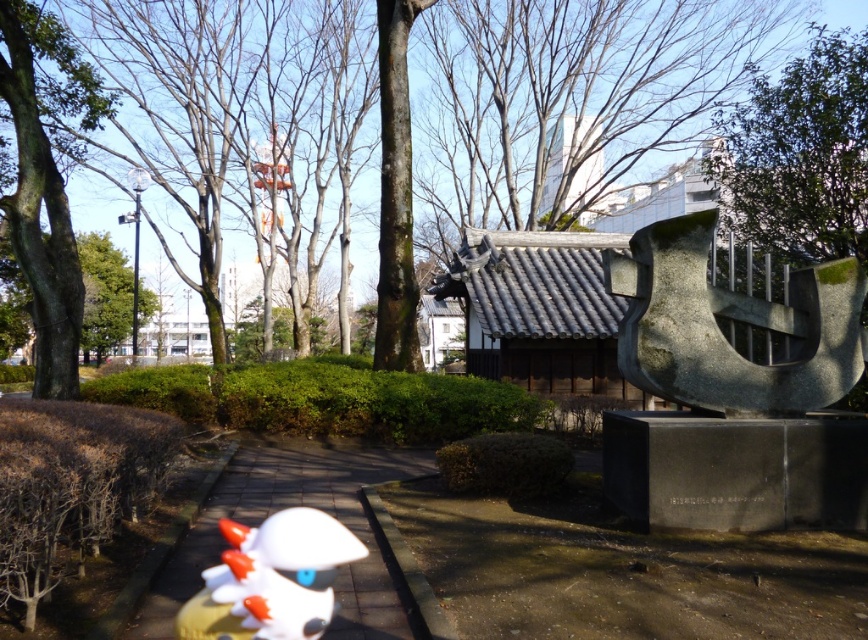
Question: Among these points, which one is farthest from the camera?

Choices:
 (A) (21, 291)
 (B) (731, 51)
 (C) (56, 346)
 (D) (299, 604)

Answer: (B)

Question: Can you confirm if brown wood tree at upper center is positioned below white matte duck at center?

Choices:
 (A) yes
 (B) no

Answer: (B)

Question: Estimate the real-world distances between objects in this image. Which object is farther from the white matte duck at center?

Choices:
 (A) brown wood tree at upper center
 (B) green leafy tree at left

Answer: (A)

Question: From the image, what is the correct spatial relationship of green leafy tree at left in relation to brown rough tree at left?

Choices:
 (A) below
 (B) above

Answer: (B)

Question: Which object is positioned closest to the brown rough tree at left?

Choices:
 (A) white matte duck at center
 (B) green stone sculpture at right
 (C) green leafy tree at left

Answer: (C)

Question: Can you confirm if green leafy tree at left is bigger than brown rough tree at left?

Choices:
 (A) no
 (B) yes

Answer: (A)